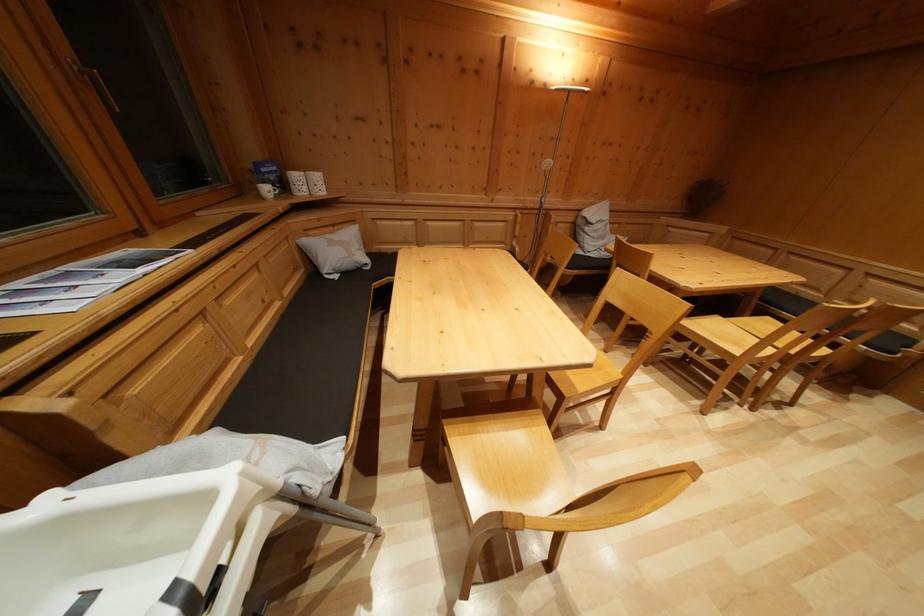
This screenshot has height=616, width=924. Find the location of `small white mug`. small white mug is located at coordinates (265, 191).